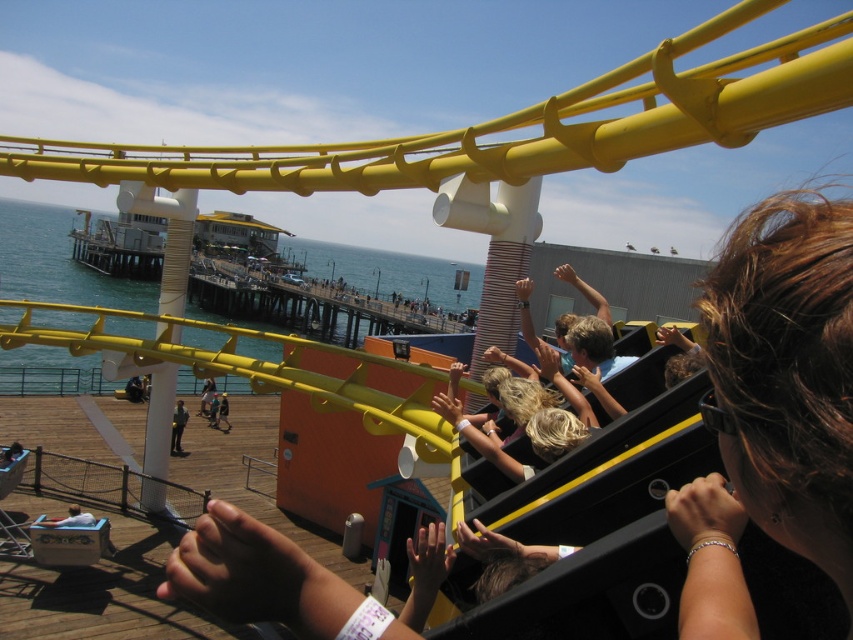
Question: Where is dark gray pants at lower left located in relation to light brown hair at center in the image?

Choices:
 (A) right
 (B) left

Answer: (A)

Question: Can you confirm if dark brown hair at upper right is positioned to the right of brown hair at upper right?

Choices:
 (A) yes
 (B) no

Answer: (B)

Question: Which of the following is the closest to the observer?

Choices:
 (A) dark gray pants at lower left
 (B) brown hair at upper right
 (C) light brown hair at center

Answer: (B)

Question: Estimate the real-world distances between objects in this image. Which object is closer to the light brown hair at center?

Choices:
 (A) light blue shirt at lower left
 (B) dark gray pants at lower left

Answer: (B)

Question: Can you confirm if brown hair at upper right is positioned below light brown hair at center?

Choices:
 (A) no
 (B) yes

Answer: (A)

Question: Which is nearer to the light brown leather jacket at center?

Choices:
 (A) blue water at lower left
 (B) light blue shirt at lower left
 (C) brown hair at upper right

Answer: (B)